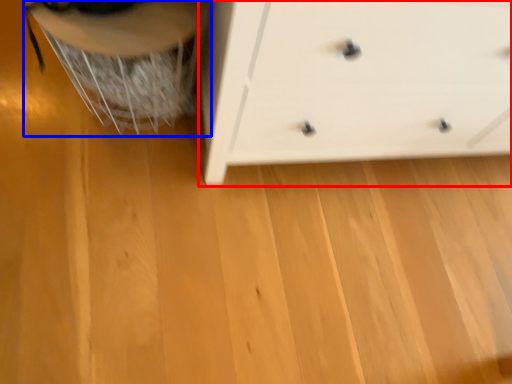
Question: Which point is further to the camera, chest of drawers (highlighted by a red box) or swivel chair (highlighted by a blue box)?

Choices:
 (A) chest of drawers
 (B) swivel chair

Answer: (B)